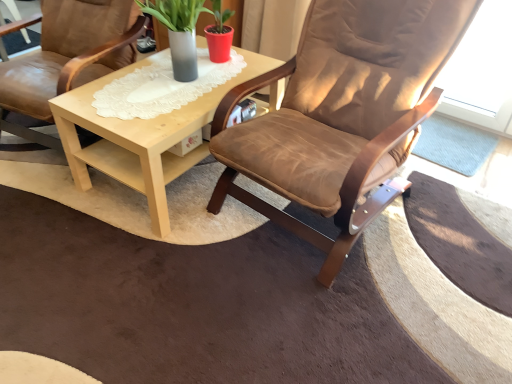
Where is `free space in front of light wood/texture coffee table at center`? free space in front of light wood/texture coffee table at center is located at coordinates (150, 271).